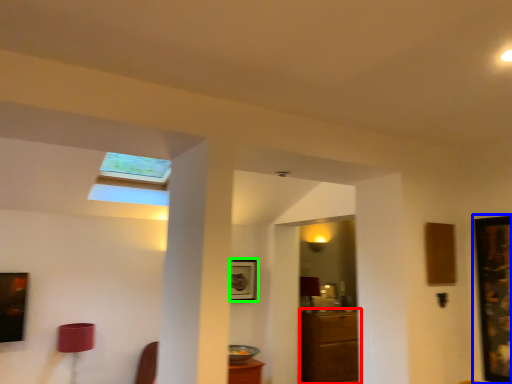
Question: Based on their relative distances, which object is farther from furniture (highlighted by a red box)? Choose from picture frame (highlighted by a blue box) and picture frame (highlighted by a green box).

Choices:
 (A) picture frame
 (B) picture frame

Answer: (A)